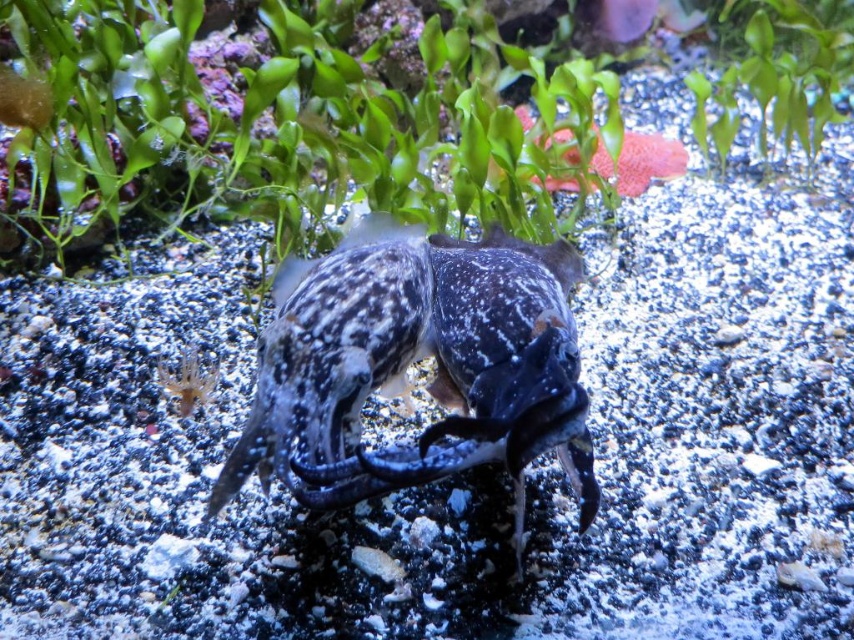
You are an underwater explorer observing the aquarium scene. You notice both the green leafy plant at upper center and the smooth pink starfish at upper center. From your vantage point, which one is positioned to the left?

The green leafy plant at upper center is to the left of the smooth pink starfish at upper center, so the green leafy plant at upper center is positioned to the left.

Looking at this image, you are an underwater photographer aiming to capture a clear shot of the speckled rubber fish at center. Your camera is positioned at point (414, 360). However, there are aquatic plants with long, slender leaves in the background. Will the plants obstruct your view of the fish?

The point (414, 360) marks the speckled rubber fish at center, so positioning the camera there would place the fish directly in the center of the shot. Since the aquatic plants are in the background, they might not obstruct the view unless they are between the camera and the fish. However, the description mentions the plants are densely packed in the background, so it depends on their exact placement. Without more details, it is uncertain if the plants will block the view.

You are an underwater photographer aiming to capture both the speckled rubber fish at center and the smooth pink starfish at upper center in a single frame. Given their sizes, which subject should you focus on to ensure both fit clearly in the photo?

The speckled rubber fish at center is larger than the smooth pink starfish at upper center, so you should focus on the speckled rubber fish at center to ensure both subjects fit clearly in the photo by adjusting the camera angle to accommodate its size.